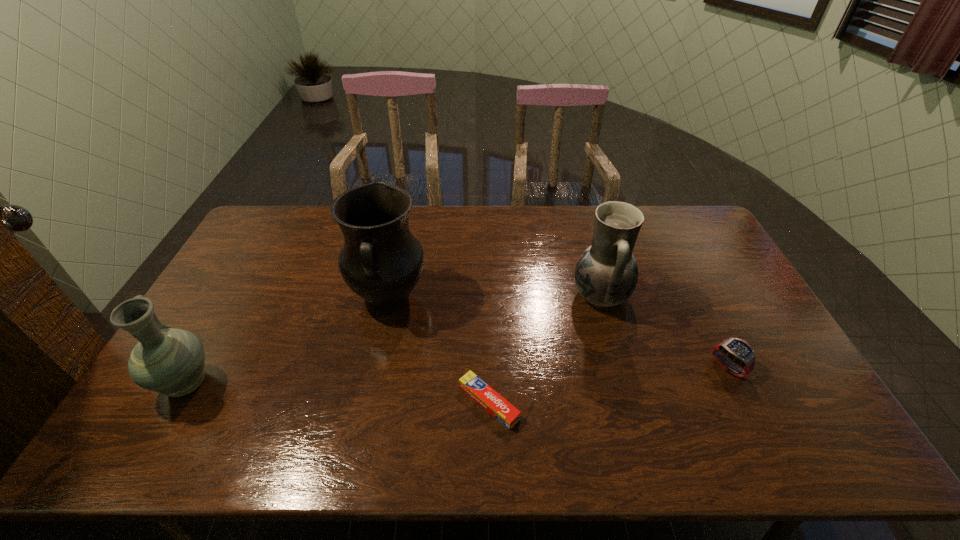
The width and height of the screenshot is (960, 540). I want to click on the second pitcher from left to right, so click(381, 261).

Where is `the rightmost pitcher`? The image size is (960, 540). the rightmost pitcher is located at coordinates (606, 274).

Image resolution: width=960 pixels, height=540 pixels. Identify the location of the nearest pitcher. (170, 361).

You are a GUI agent. You are given a task and a screenshot of the screen. Output one action in this format:
    pyautogui.click(x=<x>, y=<y>)
    Task: Click on the leftmost pitcher
    Image resolution: width=960 pixels, height=540 pixels.
    Given the screenshot: What is the action you would take?
    pyautogui.click(x=170, y=361)

Identify the location of the fourth tallest object. The image size is (960, 540). [738, 351].

Identify the location of the rightmost object. This screenshot has width=960, height=540. (738, 351).

At what (x,y) coordinates should I click in order to perform the action: click on toothpaste. Please return your answer as a coordinate pair (x, y). Looking at the image, I should click on (487, 397).

You are a GUI agent. You are given a task and a screenshot of the screen. Output one action in this format:
    pyautogui.click(x=<x>, y=<y>)
    Task: Click on the third object from left to right
    
    Given the screenshot: What is the action you would take?
    pyautogui.click(x=487, y=397)

Where is `free space located on the handle side of the second pitcher from left to right`? free space located on the handle side of the second pitcher from left to right is located at coordinates (364, 413).

I want to click on free space located on the front-facing side of the rightmost pitcher, so tap(457, 295).